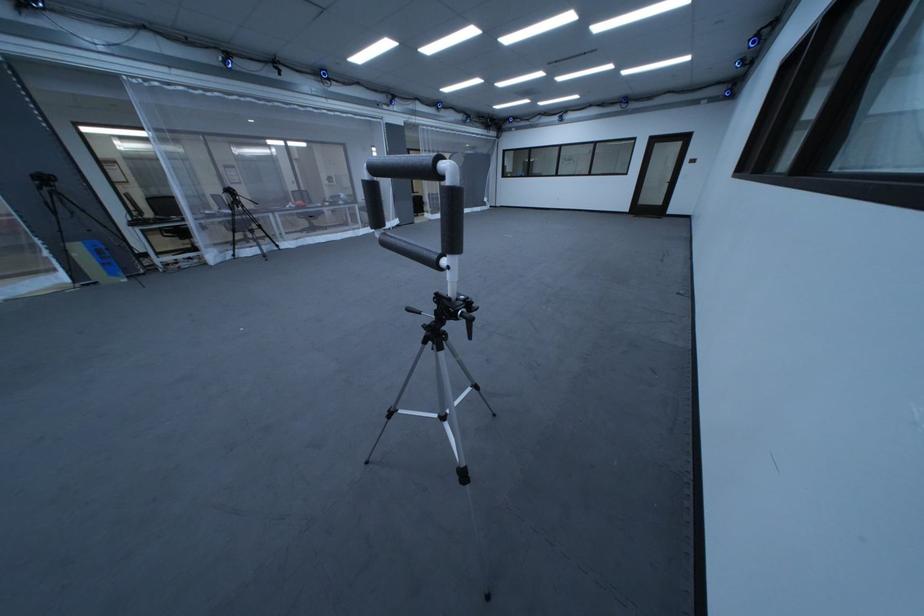
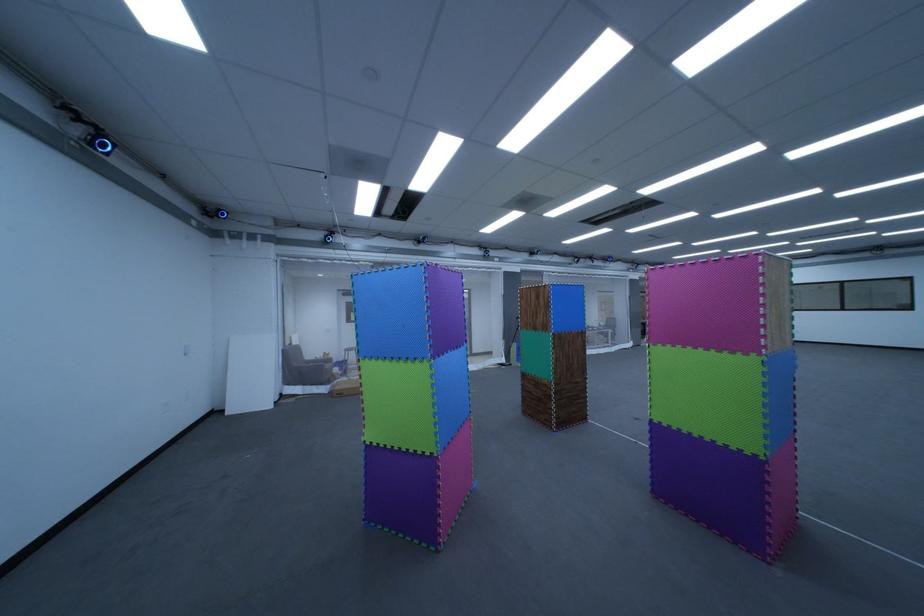
Locate, in the second image, the point that corresponds to point 403,126 in the first image.

(647, 281)